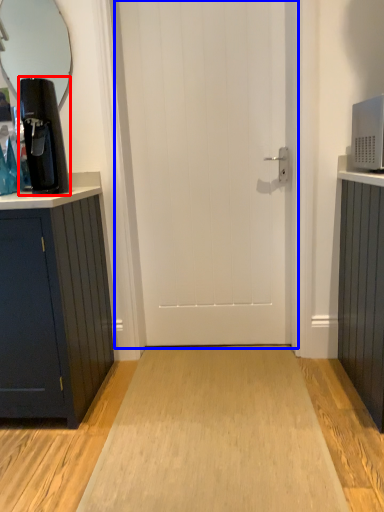
Question: Among these objects, which one is farthest to the camera, coffee machine (highlighted by a red box) or door (highlighted by a blue box)?

Choices:
 (A) coffee machine
 (B) door

Answer: (B)